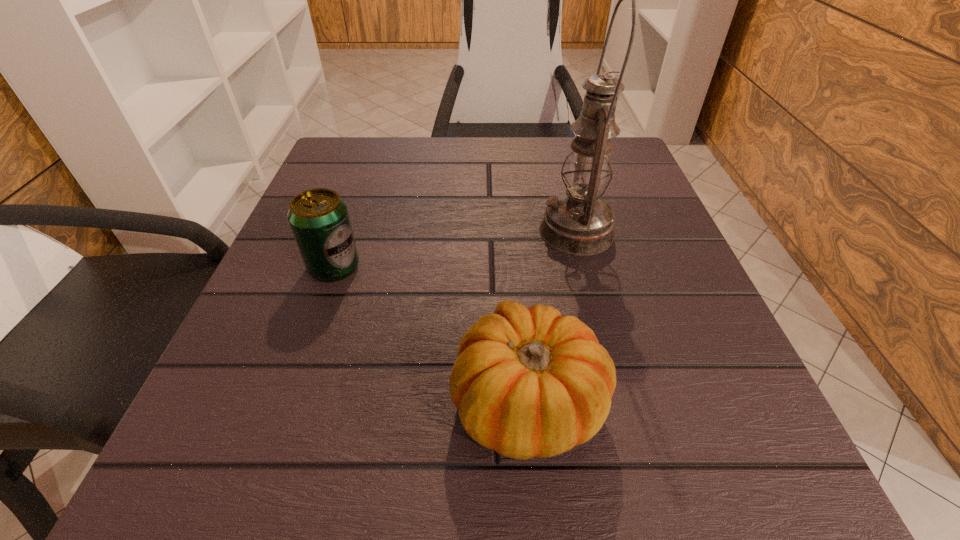
Find the location of a particular element. The image size is (960, 540). the tallest object is located at coordinates (578, 222).

Where is `the leftmost object`? the leftmost object is located at coordinates (319, 219).

You are a GUI agent. You are given a task and a screenshot of the screen. Output one action in this format:
    pyautogui.click(x=<x>, y=<y>)
    Task: Click on the gourd
    The width and height of the screenshot is (960, 540).
    Given the screenshot: What is the action you would take?
    pyautogui.click(x=527, y=382)

The width and height of the screenshot is (960, 540). I want to click on vacant space located on the back of the tallest object, so click(x=566, y=193).

Find the location of `free region located 0.220m on the back of the leftmost object`. free region located 0.220m on the back of the leftmost object is located at coordinates (364, 181).

Locate an element on the screen. This screenshot has height=540, width=960. vacant area situated on the left of the nearest object is located at coordinates (317, 402).

Find the location of a particular element. object that is positioned at the near edge is located at coordinates (527, 382).

I want to click on object that is positioned at the left edge, so click(319, 219).

Where is `object that is at the right edge`? This screenshot has width=960, height=540. object that is at the right edge is located at coordinates (578, 222).

The height and width of the screenshot is (540, 960). I want to click on vacant space at the far edge, so click(x=437, y=139).